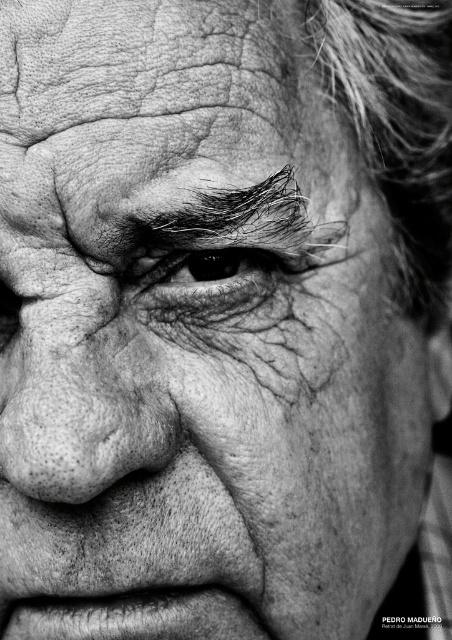
Question: Which point appears closest to the camera in this image?

Choices:
 (A) (201, 252)
 (B) (56, 429)
 (C) (182, 186)
 (D) (46, 134)

Answer: (B)

Question: Can you confirm if smooth skin forehead at upper center is bigger than black textured eye at center?

Choices:
 (A) no
 (B) yes

Answer: (B)

Question: Does dark hair at upper center have a larger size compared to black textured eye at center?

Choices:
 (A) no
 (B) yes

Answer: (B)

Question: Does smooth skin forehead at upper center appear under black textured eye at center?

Choices:
 (A) no
 (B) yes

Answer: (A)

Question: Among these objects, which one is nearest to the camera?

Choices:
 (A) dark hair at upper center
 (B) dull skin nose at center
 (C) black textured eye at center

Answer: (B)

Question: Estimate the real-world distances between objects in this image. Which object is farther from the black textured eye at center?

Choices:
 (A) dark hair at upper center
 (B) smooth skin forehead at upper center
 (C) dull skin nose at center

Answer: (B)